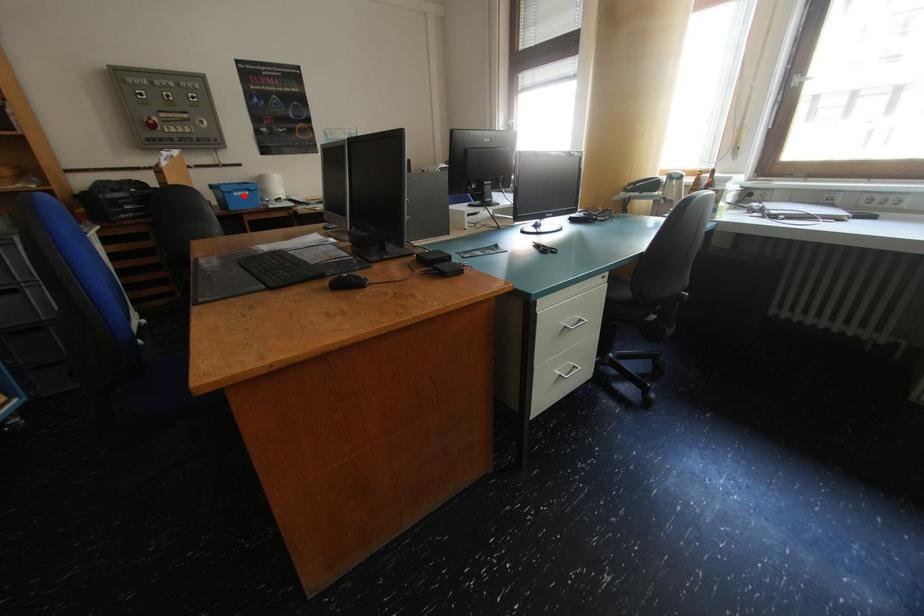
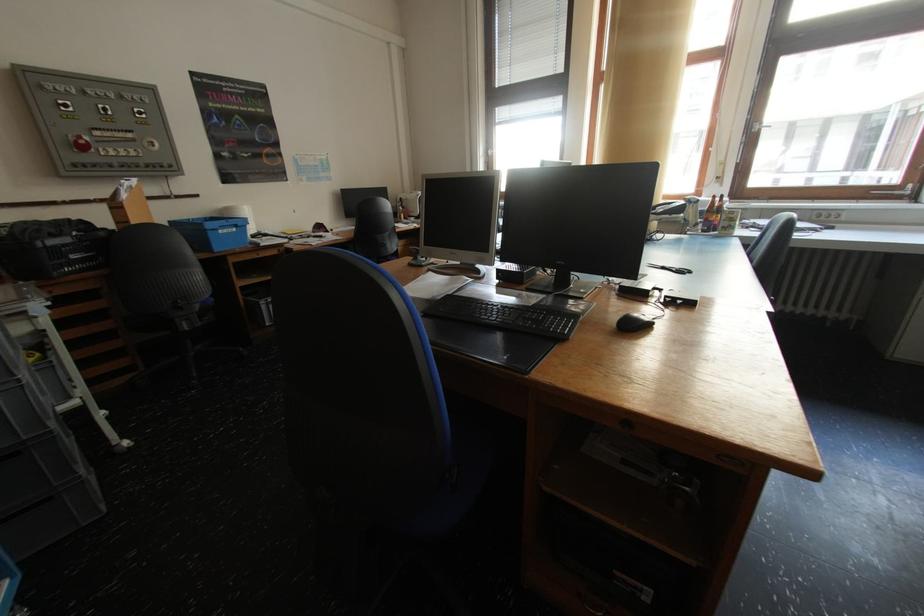
The point at the highlighted location is marked in the first image. Where is the corresponding point in the second image?

(228, 233)